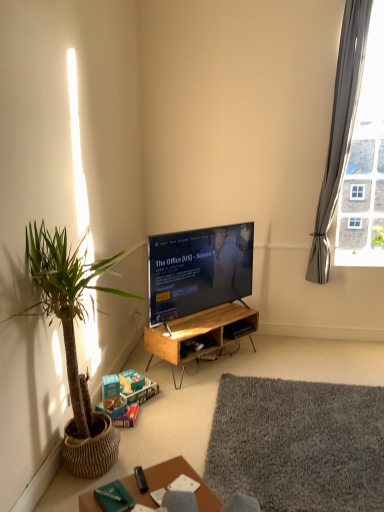
Identify the location of vacant region to the right of woodenmaterial/texturedesk at center. This screenshot has width=384, height=512. (282, 356).